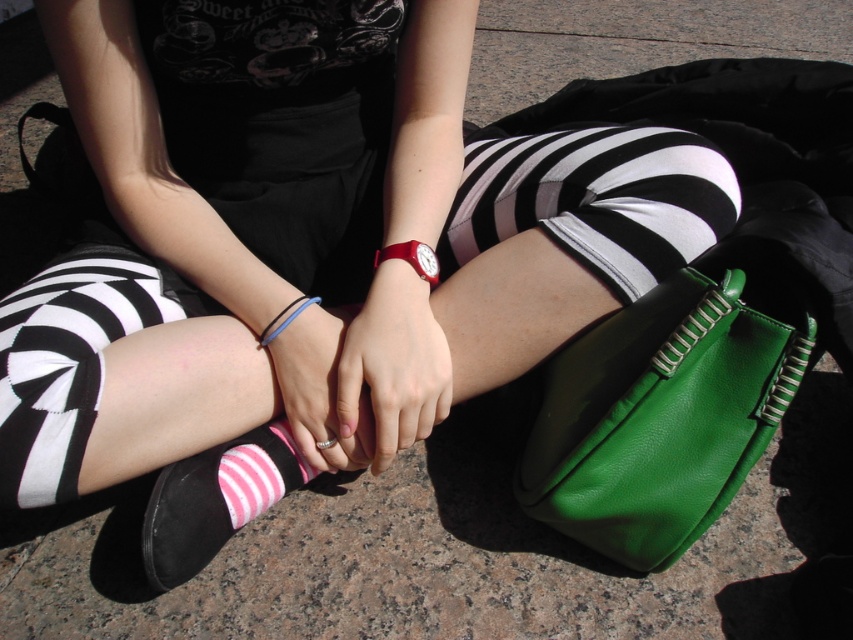
You are a photographer trying to capture a close detail shot of the black and white striped tights at center and the black rubber bracelet at center. Since you want to focus on both objects equally, which one should you zoom in closer to ensure both are in focus?

The black and white striped tights at center is larger in size than the black rubber bracelet at center, so you should zoom in closer to the black rubber bracelet at center to balance their sizes in the frame.

Looking at this image, you are a photographer trying to capture a close shot of the green leather handbag at lower right and the black rubber bracelet at center. Since the camera can only focus on one object at a time, which object should you focus on to ensure it appears larger in the photo?

The green leather handbag at lower right is taller than the black rubber bracelet at center, so focusing on the green leather handbag at lower right will make it appear larger in the photo.